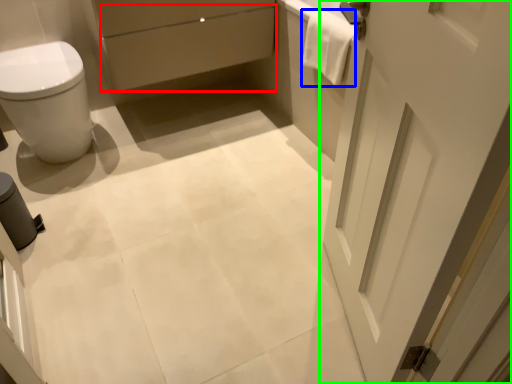
Question: Which object is the closest to the drawer (highlighted by a red box)? Choose among these: material (highlighted by a blue box) or door (highlighted by a green box).

Choices:
 (A) material
 (B) door

Answer: (A)